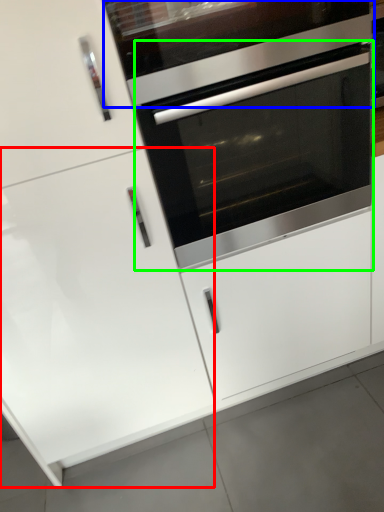
Question: Based on their relative distances, which object is nearer to door (highlighted by a red box)? Choose from vent (highlighted by a blue box) and oven (highlighted by a green box).

Choices:
 (A) vent
 (B) oven

Answer: (B)